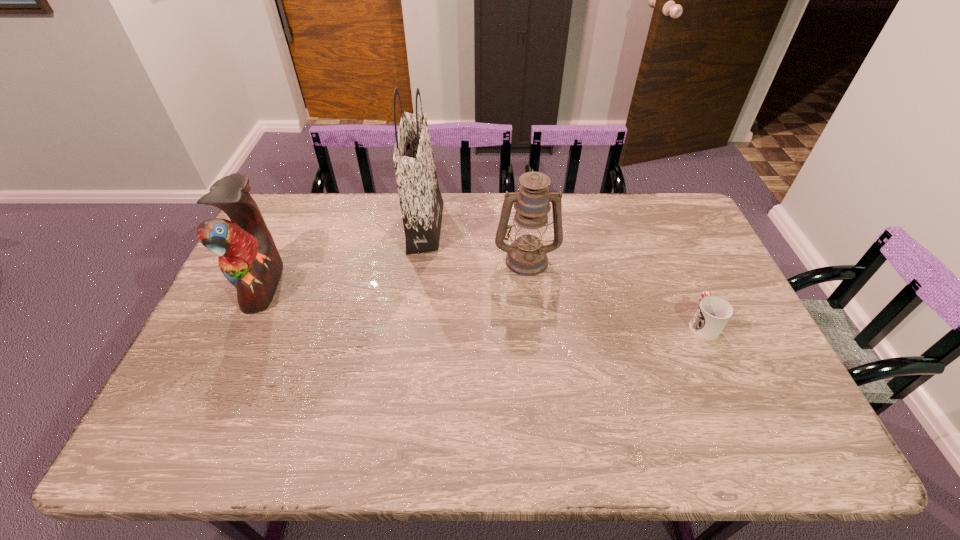
The height and width of the screenshot is (540, 960). In order to click on empty location between the leftmost object and the shortest object in this screenshot , I will do `click(483, 305)`.

At what (x,y) coordinates should I click in order to perform the action: click on free spot between the shortest object and the tallest object. Please return your answer as a coordinate pair (x, y). The height and width of the screenshot is (540, 960). Looking at the image, I should click on (564, 275).

Image resolution: width=960 pixels, height=540 pixels. In order to click on unoccupied area between the parrot and the rightmost object in this screenshot , I will do `click(483, 305)`.

Locate an element on the screen. The height and width of the screenshot is (540, 960). vacant space that is in between the second object from right to left and the cup is located at coordinates (614, 292).

Locate an element on the screen. free point between the oil lamp and the cup is located at coordinates (614, 292).

At what (x,y) coordinates should I click in order to perform the action: click on empty location between the second object from left to right and the shortest object. Please return your answer as a coordinate pair (x, y). This screenshot has height=540, width=960. Looking at the image, I should click on (564, 275).

In order to click on vacant space that is in between the oil lamp and the tallest object in this screenshot , I will do `click(476, 243)`.

Image resolution: width=960 pixels, height=540 pixels. Find the location of `vacant area that lies between the leftmost object and the oil lamp`. vacant area that lies between the leftmost object and the oil lamp is located at coordinates (395, 272).

Find the location of a particular element. This screenshot has width=960, height=540. blank region between the oil lamp and the parrot is located at coordinates (395, 272).

What are the coordinates of `vacant region between the rightmost object and the leftmost object` in the screenshot? It's located at (483, 305).